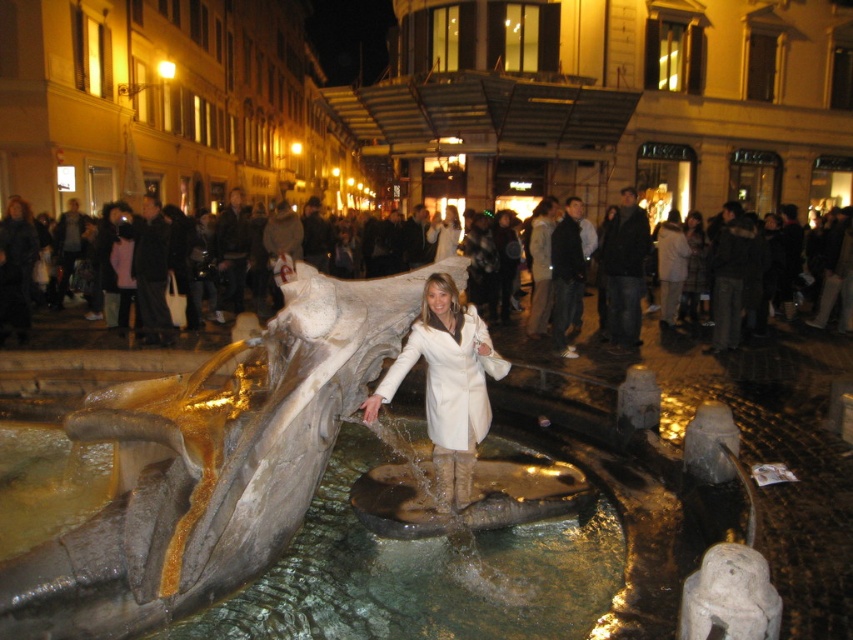
You are a photographer trying to capture a clear shot of the white leather coat at center and the white textured crowd at center. Since both are white, you need to adjust your camera settings to distinguish their heights. Based on the scene, which object is taller?

The white leather coat at center is taller than the white textured crowd at center.

You are standing at the point marked as point (422, 572) in the image. What surface are you standing on?

You are standing on the translucent stone water at center.